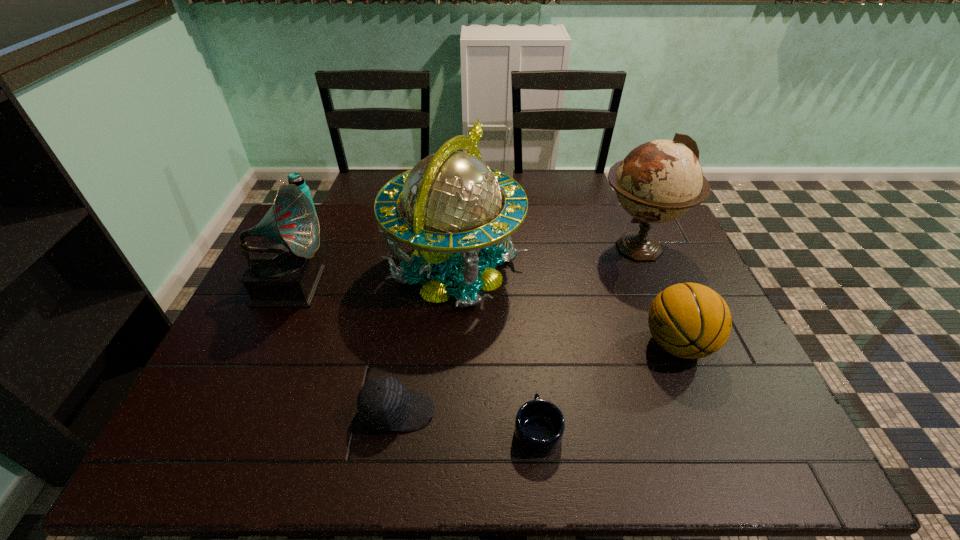
At what (x,y) coordinates should I click in order to perform the action: click on free space located 0.090m on the front of the right globe showing Asia. Please return your answer as a coordinate pair (x, y). Looking at the image, I should click on (568, 247).

This screenshot has width=960, height=540. Find the location of `vacant space located 0.390m on the horn of the third tallest object`. vacant space located 0.390m on the horn of the third tallest object is located at coordinates (453, 283).

The image size is (960, 540). Identify the location of free region located 0.270m on the right of the water bottle. (393, 225).

At what (x,y) coordinates should I click in order to perform the action: click on vacant space located 0.150m on the surface of the basketball near the brand logo. Please return your answer as a coordinate pair (x, y). This screenshot has width=960, height=540. Looking at the image, I should click on (587, 345).

Image resolution: width=960 pixels, height=540 pixels. What are the coordinates of `vacant space located on the surface of the basketball near the brand logo` in the screenshot? It's located at (587, 345).

Where is `free region located on the surface of the basketball near the brand logo`? The width and height of the screenshot is (960, 540). free region located on the surface of the basketball near the brand logo is located at coordinates (499, 345).

You are a GUI agent. You are given a task and a screenshot of the screen. Output one action in this format:
    pyautogui.click(x=<x>, y=<y>)
    Task: Click on the vacant region located at the front of the baseball cap where the brim is located
    The width and height of the screenshot is (960, 540).
    Given the screenshot: What is the action you would take?
    pyautogui.click(x=530, y=411)

This screenshot has width=960, height=540. What are the coordinates of `vacant area located 0.060m with the handle on the side of the shortest object` in the screenshot? It's located at (533, 383).

Locate an element on the screen. The image size is (960, 540). vacant area situated 0.270m with the handle on the side of the shortest object is located at coordinates (526, 321).

The width and height of the screenshot is (960, 540). I want to click on free space located with the handle on the side of the shortest object, so click(529, 343).